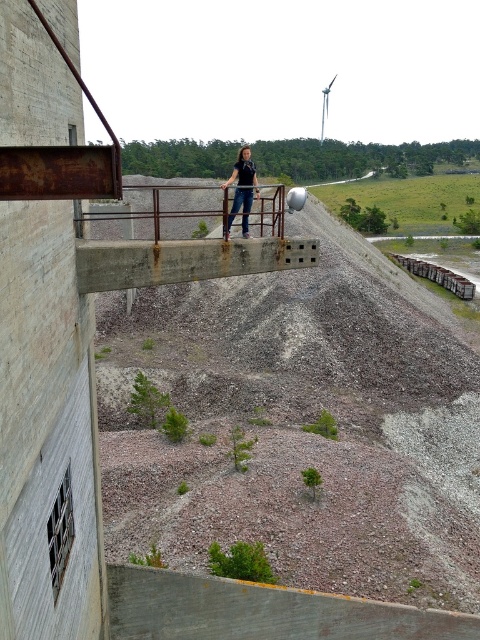
You are a safety inspector checking the construction site. You see the rusty metal balustrade at center and the rusty metal rail at center. Which one is located above the other?

The rusty metal balustrade at center is positioned over the rusty metal rail at center, meaning the balustrade is above the rail.